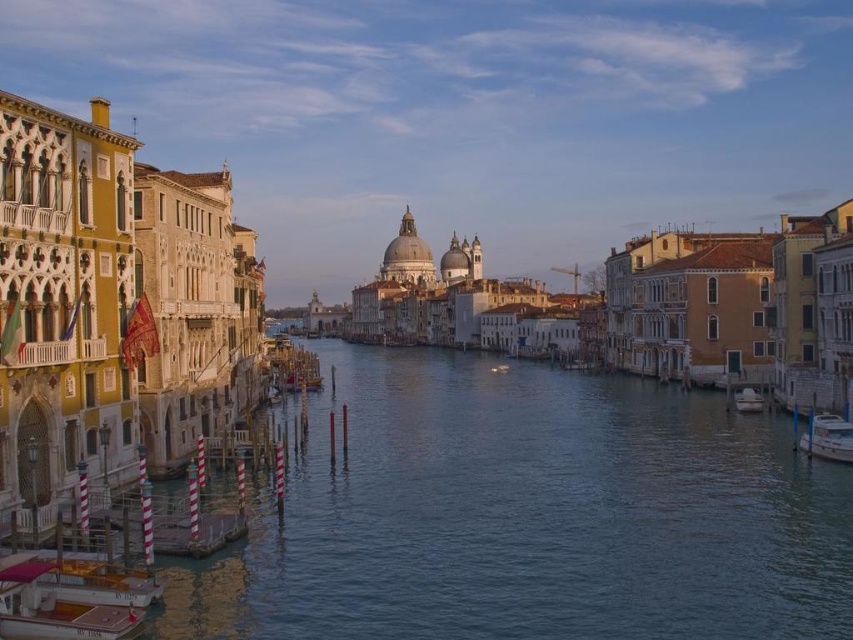
You are a tourist in Venice and want to take a boat ride. You see a wooden polished boat at lower left and a white glossy boat at lower right. Which boat is shorter?

The wooden polished boat at lower left is shorter than the white glossy boat at lower right.

You are a tourist standing on the bridge overlooking the canal. You notice two white glossy boats in the water. Which boat, the white glossy boat at right or the white glossy boat at lower right, appears taller when viewed from your position on the bridge?

The white glossy boat at right appears taller than the white glossy boat at lower right when viewed from the bridge.

Consider the image. You are standing on a gondola in the canal and want to reach a destination marked by point (839, 438). There is an obstacle at point (88, 600). Which point should you avoid to ensure a safe path?

You should avoid point (88, 600) because it is closer to you than point (839, 438), so it lies in your path towards the destination.